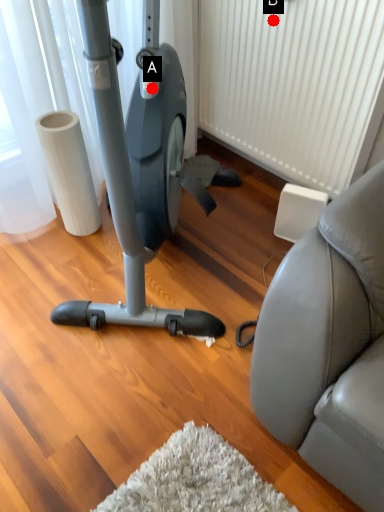
Question: Two points are circled on the image, labeled by A and B beside each circle. Which point is closer to the camera?

Choices:
 (A) A is closer
 (B) B is closer

Answer: (A)